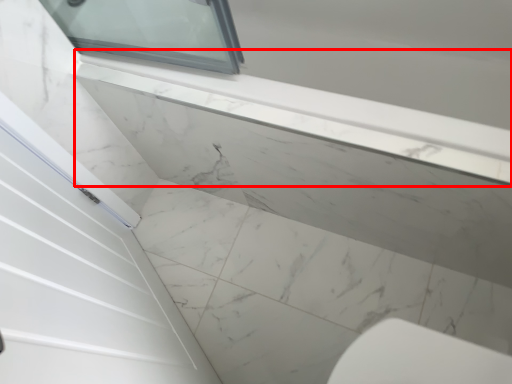
Question: From the image's perspective, what is the correct spatial positioning of window sill (annotated by the red box) in reference to concrete?

Choices:
 (A) above
 (B) below

Answer: (A)